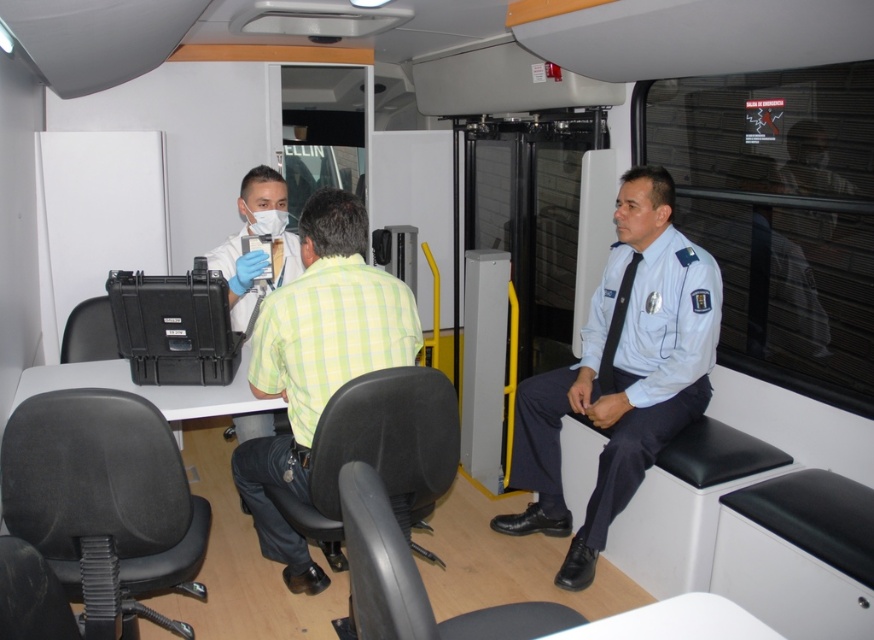
Question: Which point is closer to the camera taking this photo?

Choices:
 (A) (566, 385)
 (B) (378, 376)
 (C) (274, 330)

Answer: (B)

Question: Estimate the real-world distances between objects in this image. Which object is closer to the black plastic chair at lower center?

Choices:
 (A) light green checkered shirt at center
 (B) light blue uniform at right
 (C) black fabric chair at center
 (D) black leather seat at lower right

Answer: (C)

Question: Can you confirm if black leather seat at lower right is positioned below black fabric chair at center?

Choices:
 (A) no
 (B) yes

Answer: (B)

Question: Estimate the real-world distances between objects in this image. Which object is closer to the black plastic chair at lower left?

Choices:
 (A) light blue uniform at right
 (B) black fabric chair at center
 (C) black plastic chair at lower center
 (D) light green checkered shirt at center

Answer: (D)

Question: From the image, what is the correct spatial relationship of black fabric chair at lower left in relation to black leather seat at lower right?

Choices:
 (A) above
 (B) below

Answer: (A)

Question: Can you confirm if light green checkered shirt at center is smaller than black plastic chair at lower center?

Choices:
 (A) no
 (B) yes

Answer: (A)